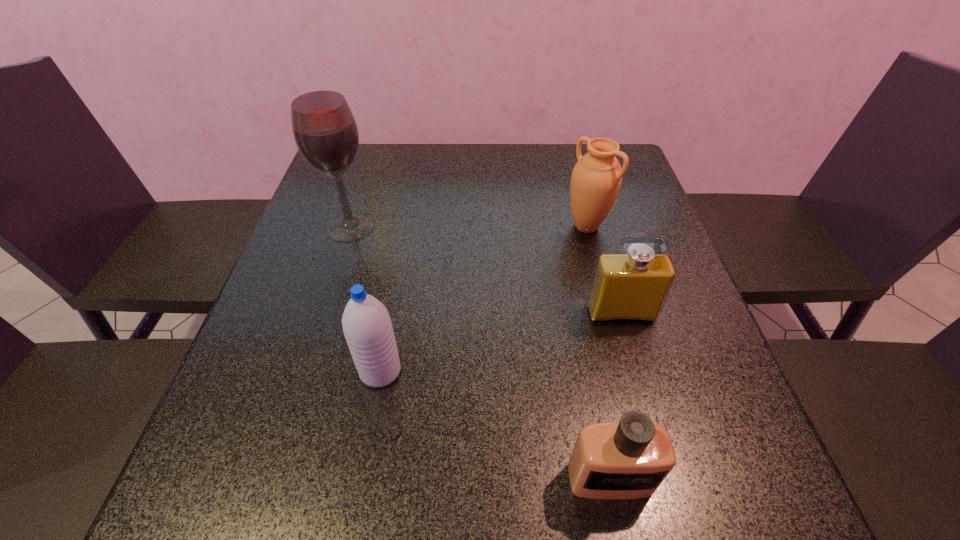
Where is `the tallest object`? the tallest object is located at coordinates (325, 131).

What are the coordinates of `the leftmost object` in the screenshot? It's located at (325, 131).

At what (x,y) coordinates should I click in order to perform the action: click on urn. Please return your answer as a coordinate pair (x, y). Looking at the image, I should click on (596, 179).

Where is `the second nearest object`? The width and height of the screenshot is (960, 540). the second nearest object is located at coordinates (367, 326).

Find the location of `water bottle`. water bottle is located at coordinates (367, 326).

You are a GUI agent. You are given a task and a screenshot of the screen. Output one action in this format:
    pyautogui.click(x=<x>, y=<y>)
    Task: Click on the third nearest object
    The image size is (960, 540).
    Given the screenshot: What is the action you would take?
    pyautogui.click(x=627, y=287)

The height and width of the screenshot is (540, 960). In order to click on the shorter perfume in this screenshot , I will do `click(629, 459)`.

Identify the location of the nearest object. The image size is (960, 540). (629, 459).

Locate an element on the screen. The height and width of the screenshot is (540, 960). free space located 0.070m on the back of the alcohol is located at coordinates pos(361,194).

Image resolution: width=960 pixels, height=540 pixels. I want to click on vacant space located 0.190m on the back of the urn, so click(x=572, y=172).